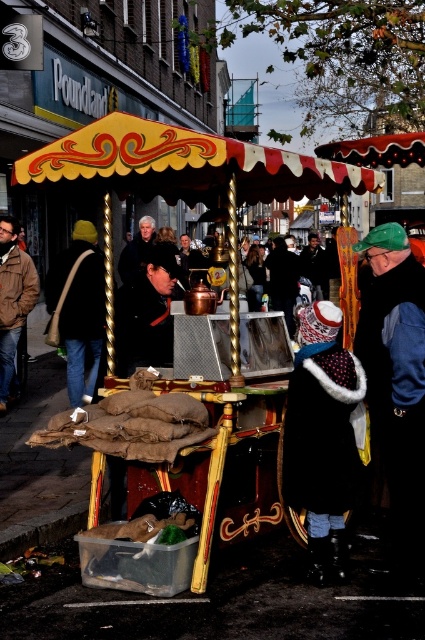
You are a customer at the mulled wine stall and want to place your brown leather jacket at center onto the gold polished cart at center. Can you fit the jacket on the cart?

The gold polished cart at center is larger in size than brown leather jacket at center, so yes, the jacket can be placed on the cart without any issues.

You are a street performer preparing to set up your equipment. You have a gold polished cart at center and a black leather jacket at center in front of you. Which object is wider?

The gold polished cart at center is wider than the black leather jacket at center because the gold polished cart at center has a greater width compared to the black leather jacket at center.